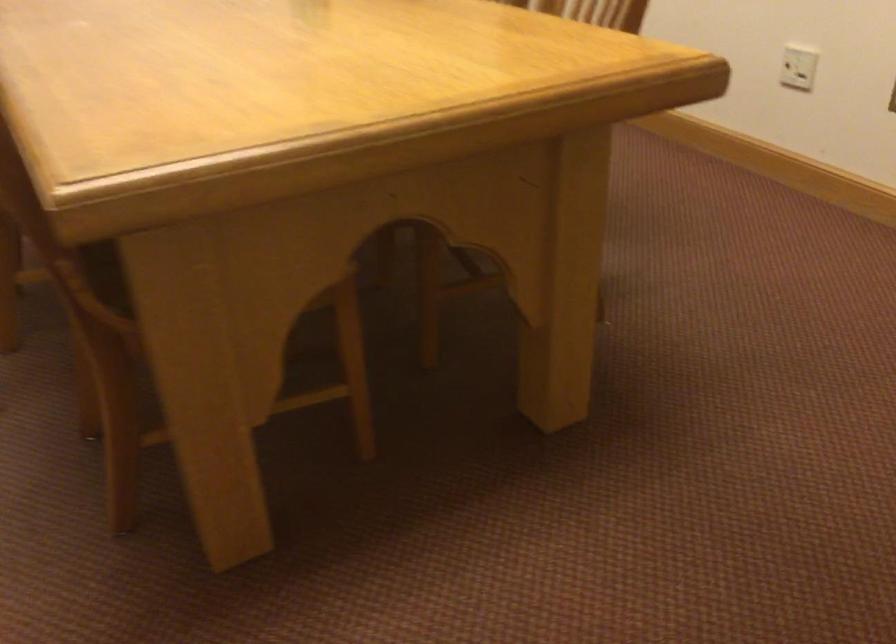
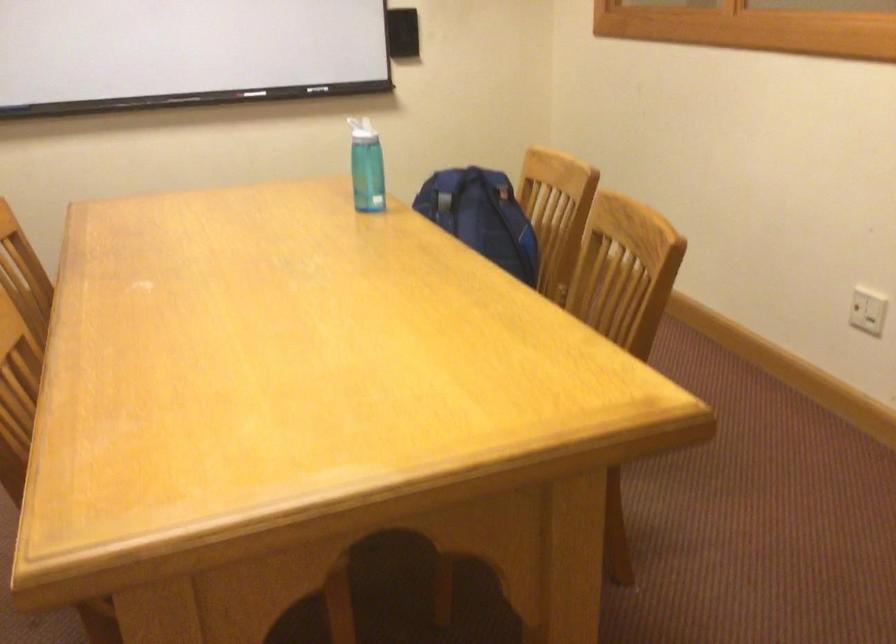
Question: The images are taken continuously from a first-person perspective. In which direction is your viewpoint rotating?

Choices:
 (A) Left
 (B) Right
 (C) Up
 (D) Down

Answer: (C)